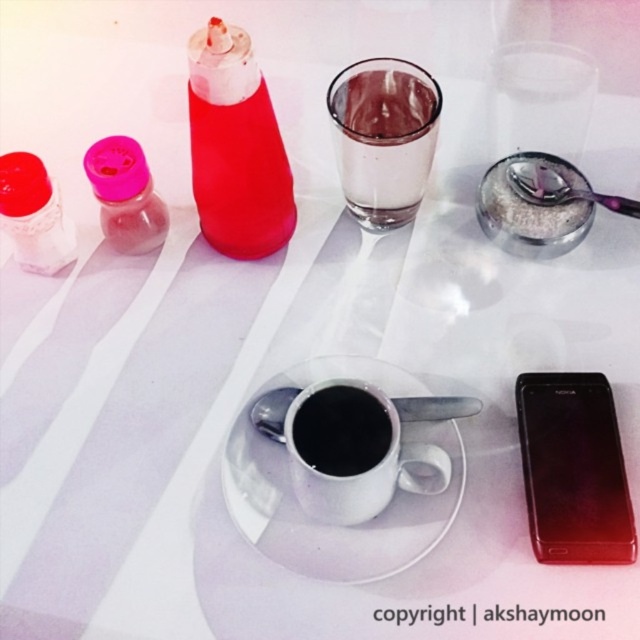
Measure the distance from white glossy saucer at center to pink plastic bottle at left.

white glossy saucer at center and pink plastic bottle at left are 8.13 inches apart from each other.

This screenshot has height=640, width=640. What do you see at coordinates (332, 525) in the screenshot? I see `white glossy saucer at center` at bounding box center [332, 525].

Which is in front, point (422, 422) or point (99, 172)?

Positioned in front is point (422, 422).

This screenshot has height=640, width=640. What are the coordinates of `white glossy saucer at center` in the screenshot? It's located at [x=332, y=525].

Which of these two, matte plastic bottle at upper left or black matte cup at center, stands shorter?

black matte cup at center

Does matte plastic bottle at upper left appear on the left side of black matte cup at center?

Indeed, matte plastic bottle at upper left is positioned on the left side of black matte cup at center.

This screenshot has width=640, height=640. What do you see at coordinates (236, 147) in the screenshot?
I see `matte plastic bottle at upper left` at bounding box center [236, 147].

You are a GUI agent. You are given a task and a screenshot of the screen. Output one action in this format:
    pyautogui.click(x=<x>, y=<y>)
    Task: Click on the matte plastic bottle at upper left
    This screenshot has height=640, width=640.
    Given the screenshot: What is the action you would take?
    pyautogui.click(x=236, y=147)

Does transparent glass at upper center have a greater width compared to black matte cup at center?

Indeed, transparent glass at upper center has a greater width compared to black matte cup at center.

Is point (406, 129) in front of point (365, 428)?

No, (406, 129) is behind (365, 428).

Find the location of a particular element. The height and width of the screenshot is (640, 640). transparent glass at upper center is located at coordinates (384, 138).